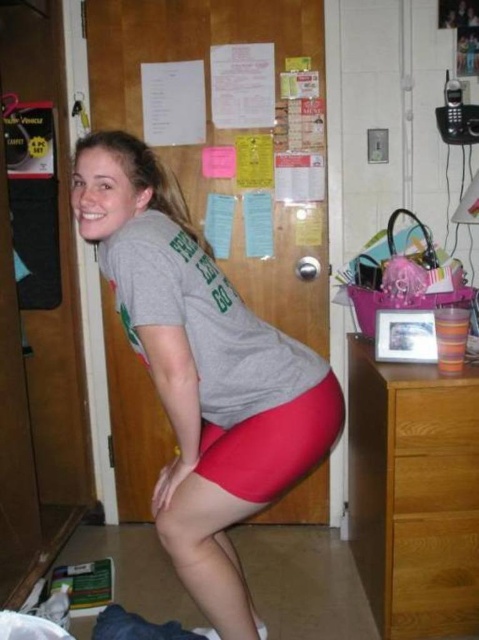
You are trying to reach the brown wooden dresser at right from your current position. Is the matte red shorts at center blocking your path? Explain why or why not.

The matte red shorts at center is closer to the viewer than the brown wooden dresser at right, so the shorts are in front of the dresser. This means the shorts are blocking the path to the dresser.

You need to place a rectangular box that is 1 meter wide on the brown wooden dresser at right or the wooden drawer at lower right. Based on their widths, which surface can accommodate the box?

The brown wooden dresser at right has a larger width than the wooden drawer at lower right. Since the box is 1 meter wide, it can fit on the brown wooden dresser at right if its width is at least 1 meter, but it may not fit on the wooden drawer at lower right due to its smaller width.

Looking at this image, you are a photographer setting up a shoot in the room. You need to ensure that the matte red shorts at center and the wooden drawer at lower right are both visible in the frame. Based on their positions, which object is closer to the camera?

The matte red shorts at center is in front of the wooden drawer at lower right, so it is closer to the camera.